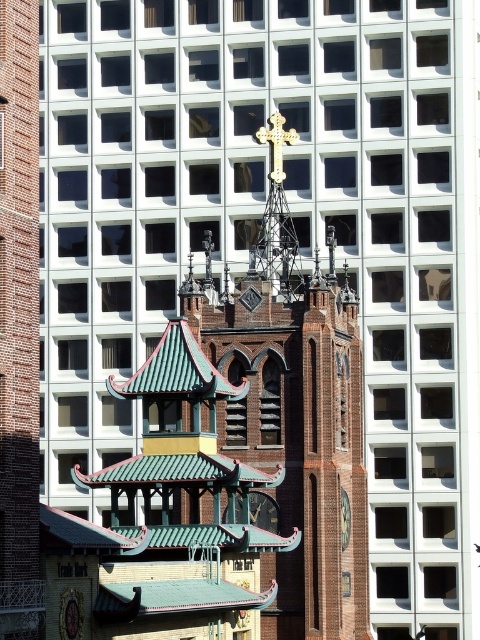
Is gold metallic cross at upper center smaller than gold metallic clock at center?

Actually, gold metallic cross at upper center might be larger than gold metallic clock at center.

Who is more distant from viewer, [274,120] or [263,493]?

The point [274,120] is behind.

The image size is (480, 640). I want to click on gold metallic cross at upper center, so click(276, 144).

Can you confirm if gold metallic cross at upper center is positioned above green wooden clock at center?

Indeed, gold metallic cross at upper center is positioned over green wooden clock at center.

Which is behind, point (262, 141) or point (345, 490)?

The point (262, 141) is more distant.

Locate an element on the screen. The width and height of the screenshot is (480, 640). gold metallic cross at upper center is located at coordinates (276, 144).

This screenshot has width=480, height=640. What are the coordinates of `gold metallic cross at upper center` in the screenshot? It's located at (276, 144).

Which is above, gold metallic cross at center or green wooden clock at center?

gold metallic cross at center

Between gold metallic cross at center and green wooden clock at center, which one is positioned lower?

green wooden clock at center

Between point (276, 211) and point (340, 532), which one is positioned behind?

The point (276, 211) is more distant.

Find the location of a particular element. The width and height of the screenshot is (480, 640). gold metallic cross at center is located at coordinates (276, 212).